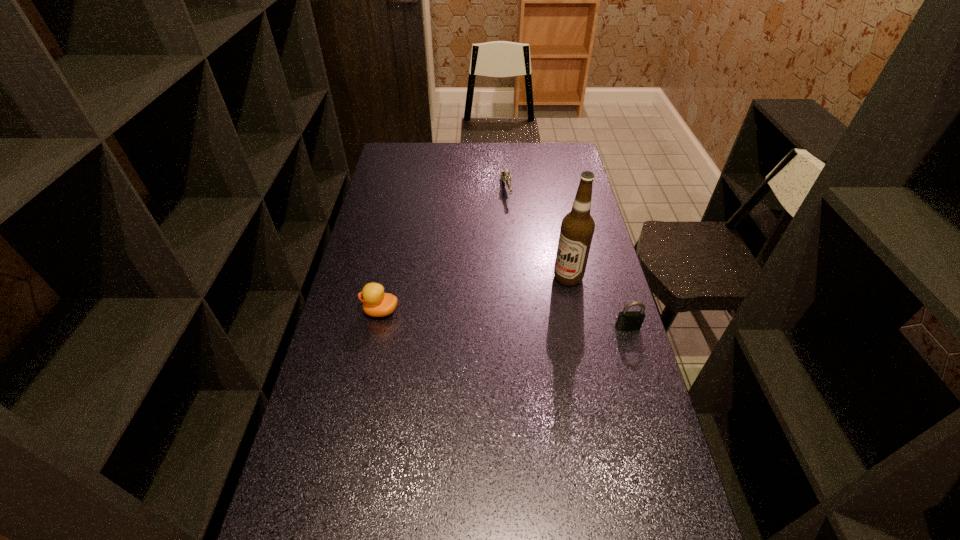
This screenshot has height=540, width=960. In the image, there is a desktop. What are the coordinates of `vacant space at the near edge` in the screenshot? It's located at (439, 538).

The image size is (960, 540). Identify the location of vacant space at the left edge. (348, 351).

In the image, there is a desktop. What are the coordinates of `vacant space at the right edge` in the screenshot? It's located at (560, 223).

You are a GUI agent. You are given a task and a screenshot of the screen. Output one action in this format:
    pyautogui.click(x=<x>, y=<y>)
    Task: Click on the free space at the far right corner
    The width and height of the screenshot is (960, 540).
    Given the screenshot: What is the action you would take?
    pyautogui.click(x=542, y=154)

At what (x,y) coordinates should I click in order to perform the action: click on free space that is in between the padlock and the duckling. Please return your answer as a coordinate pair (x, y). This screenshot has width=960, height=540. Looking at the image, I should click on [x=504, y=319].

Locate an element on the screen. vacant space in between the duckling and the second farthest object is located at coordinates (474, 294).

Identify the location of vacant space in between the third object from right to left and the third object from left to right. (537, 233).

Where is `vacant area that lies between the nearest object and the third object from left to right`? The height and width of the screenshot is (540, 960). vacant area that lies between the nearest object and the third object from left to right is located at coordinates (598, 302).

Locate an element on the screen. vacant point located between the duckling and the third object from right to left is located at coordinates (444, 250).

Identify the location of free space between the leftmost object and the third object from right to left. The height and width of the screenshot is (540, 960). (444, 250).